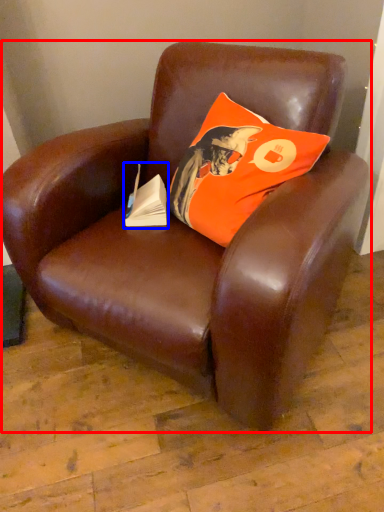
Question: Which object is further to the camera taking this photo, chair (highlighted by a red box) or paperback book (highlighted by a blue box)?

Choices:
 (A) chair
 (B) paperback book

Answer: (B)